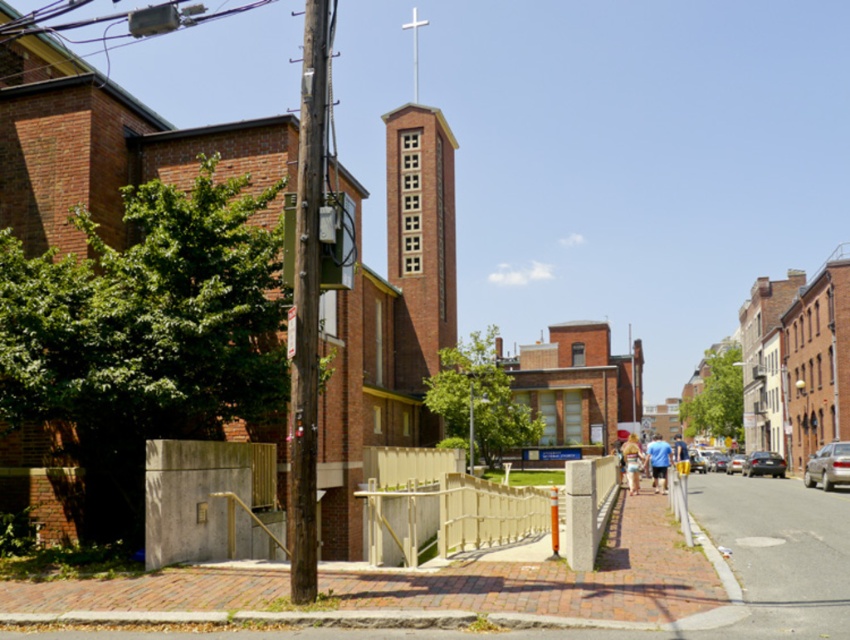
Looking at this image, you are a delivery driver who needs to park your silver metallic sedan at right on the smooth asphalt road at lower right. Can your car fit on the road without overhanging?

The smooth asphalt road at lower right is bigger than the silver metallic sedan at right, so yes, the car can fit on the road without overhanging.